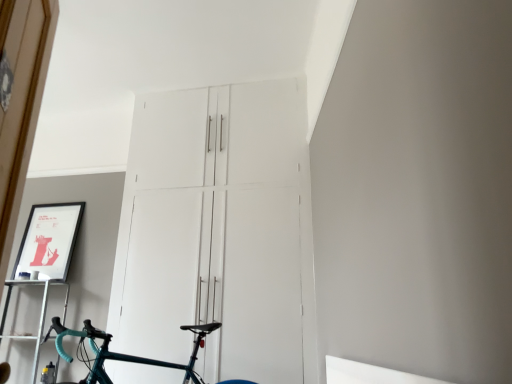
Question: Is matte black picture frame at upper left wider than teal glossy bicycle at center?

Choices:
 (A) no
 (B) yes

Answer: (A)

Question: Does matte black picture frame at upper left lie in front of teal glossy bicycle at center?

Choices:
 (A) no
 (B) yes

Answer: (A)

Question: Is matte black picture frame at upper left positioned far away from teal glossy bicycle at center?

Choices:
 (A) yes
 (B) no

Answer: (A)

Question: Could you tell me if matte black picture frame at upper left is facing teal glossy bicycle at center?

Choices:
 (A) yes
 (B) no

Answer: (B)

Question: Is matte black picture frame at upper left shorter than teal glossy bicycle at center?

Choices:
 (A) yes
 (B) no

Answer: (B)

Question: Considering their positions, is white matte cabinet at center located in front of or behind metallic silver shelf at lower left?

Choices:
 (A) behind
 (B) front

Answer: (B)

Question: Does point (223, 216) appear closer or farther from the camera than point (38, 331)?

Choices:
 (A) farther
 (B) closer

Answer: (B)

Question: From a real-world perspective, is white matte cabinet at center above or below metallic silver shelf at lower left?

Choices:
 (A) above
 (B) below

Answer: (A)

Question: From the image's perspective, is white matte cabinet at center positioned above or below metallic silver shelf at lower left?

Choices:
 (A) below
 (B) above

Answer: (B)

Question: From a real-world perspective, is white matte cabinet at center positioned above or below matte black picture frame at upper left?

Choices:
 (A) above
 (B) below

Answer: (A)

Question: Is white matte cabinet at center situated inside matte black picture frame at upper left or outside?

Choices:
 (A) outside
 (B) inside

Answer: (A)

Question: Considering the positions of white matte cabinet at center and matte black picture frame at upper left in the image, is white matte cabinet at center wider or thinner than matte black picture frame at upper left?

Choices:
 (A) thin
 (B) wide

Answer: (B)

Question: Is white matte cabinet at center in front of or behind matte black picture frame at upper left in the image?

Choices:
 (A) behind
 (B) front

Answer: (B)

Question: Is metallic silver shelf at lower left wider or thinner than matte black picture frame at upper left?

Choices:
 (A) thin
 (B) wide

Answer: (B)

Question: Does point (10, 291) appear closer or farther from the camera than point (31, 216)?

Choices:
 (A) closer
 (B) farther

Answer: (A)